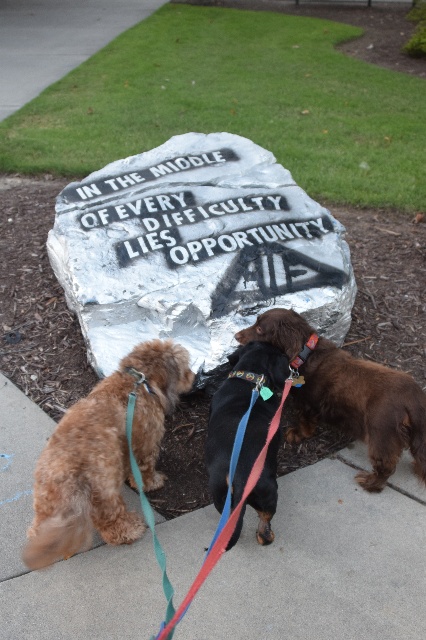
You are a delivery person with a cart that is 18 inches wide. You need to move your cart from the smooth concrete pavement at center to the black shiny dog at center. Is there enough space between them for your cart to pass through?

The smooth concrete pavement at center is 16.08 inches away from the black shiny dog at center, so the cart cannot pass through because the distance is less than the cart width of 18 inches.

From the picture: You are standing at the center of the stone monument and want to locate the black shiny dog at center. In which direction should you look relative to your position?

The black shiny dog at center is located at coordinates point (241, 416), so you should look to the right and slightly downward from the center of the stone monument.

You are a delivery person with a cart that is 1.2 meters wide. You need to move your cart through the space between the smooth concrete pavement at center and the black shiny dog at center. Can your cart fit through the space if the pavement is wider than the dog?

The smooth concrete pavement at center is wider than the black shiny dog at center, so the cart can fit through the space between them as long as the width difference allows for the cart to pass.